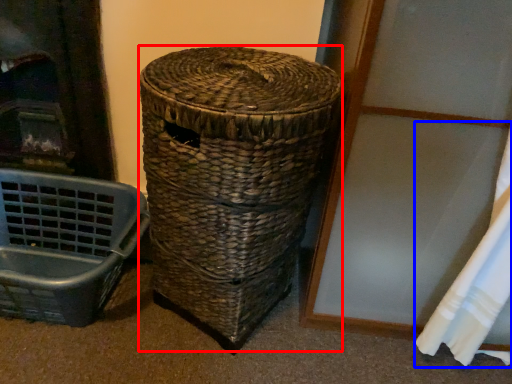
Question: Which object appears closest to the camera in this image, basket (highlighted by a red box) or curtain (highlighted by a blue box)?

Choices:
 (A) basket
 (B) curtain

Answer: (B)